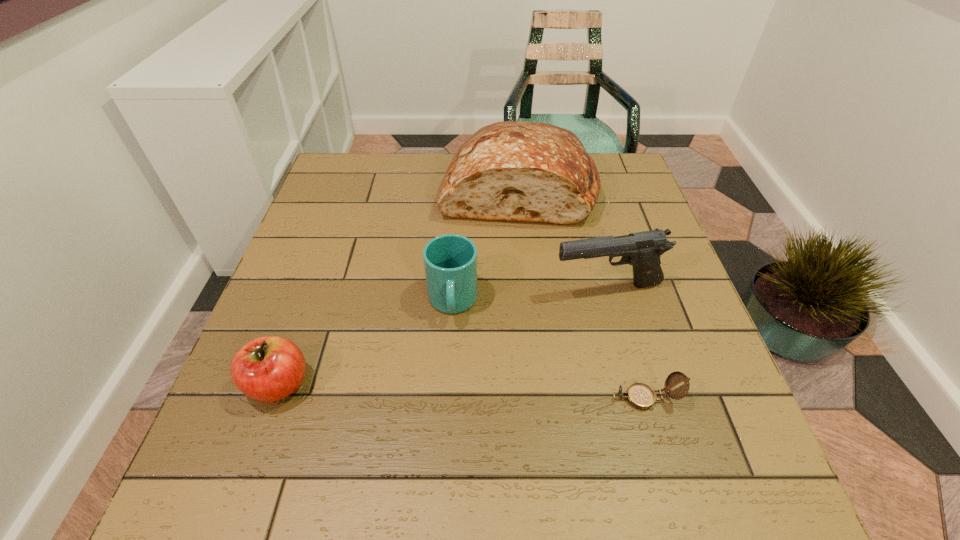
Find the location of a particular element. The width and height of the screenshot is (960, 540). apple that is at the near edge is located at coordinates (267, 369).

You are a GUI agent. You are given a task and a screenshot of the screen. Output one action in this format:
    pyautogui.click(x=<x>, y=<y>)
    Task: Click on the compass situated at the near edge
    
    Given the screenshot: What is the action you would take?
    pyautogui.click(x=639, y=395)

Locate an element on the screen. object located in the left edge section of the desktop is located at coordinates (267, 369).

Image resolution: width=960 pixels, height=540 pixels. What are the coordinates of `compass at the right edge` in the screenshot? It's located at click(x=639, y=395).

You are a GUI agent. You are given a task and a screenshot of the screen. Output one action in this format:
    pyautogui.click(x=<x>, y=<y>)
    Task: Click on the gun that is at the right edge
    The width and height of the screenshot is (960, 540).
    Given the screenshot: What is the action you would take?
    pyautogui.click(x=642, y=250)

This screenshot has height=540, width=960. I want to click on bread that is at the right edge, so click(x=520, y=171).

This screenshot has width=960, height=540. Identify the location of object that is positioned at the near left corner. (267, 369).

You are a GUI agent. You are given a task and a screenshot of the screen. Output one action in this format:
    pyautogui.click(x=<x>, y=<y>)
    Task: Click on the object located at the far right corner
    This screenshot has width=960, height=540.
    Given the screenshot: What is the action you would take?
    pyautogui.click(x=520, y=171)

The image size is (960, 540). Find the location of `object at the near right corner`. object at the near right corner is located at coordinates (639, 395).

This screenshot has height=540, width=960. In order to click on blank area at the far edge in this screenshot , I will do `click(391, 161)`.